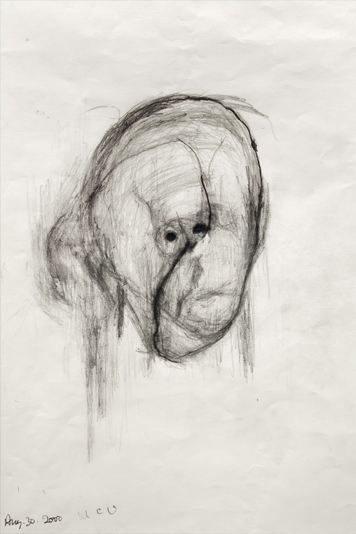
I want to click on art work, so click(x=179, y=350).